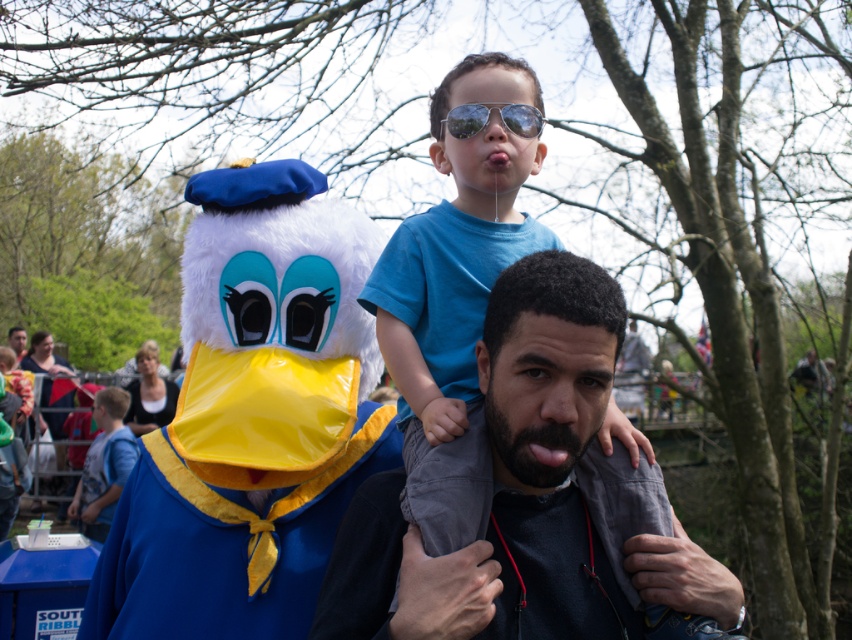
Question: Which of these objects is positioned closest to the blue cotton shirt at center?

Choices:
 (A) reflective plastic goggles at center
 (B) dark gray fabric at center

Answer: (A)

Question: Which point is farther to the camera?

Choices:
 (A) (361, 545)
 (B) (440, 144)
 (C) (485, 118)

Answer: (B)

Question: In this image, where is dark gray fabric at center located relative to blue cotton shirt at center?

Choices:
 (A) left
 (B) right

Answer: (B)

Question: Among these objects, which one is nearest to the camera?

Choices:
 (A) blue cotton shirt at center
 (B) reflective plastic goggles at center
 (C) dark gray fabric at center

Answer: (C)

Question: Observing the image, what is the correct spatial positioning of dark gray fabric at center in reference to blue cotton shirt at center?

Choices:
 (A) right
 (B) left

Answer: (A)

Question: Is the position of dark gray fabric at center more distant than that of blue cotton shirt at center?

Choices:
 (A) no
 (B) yes

Answer: (A)